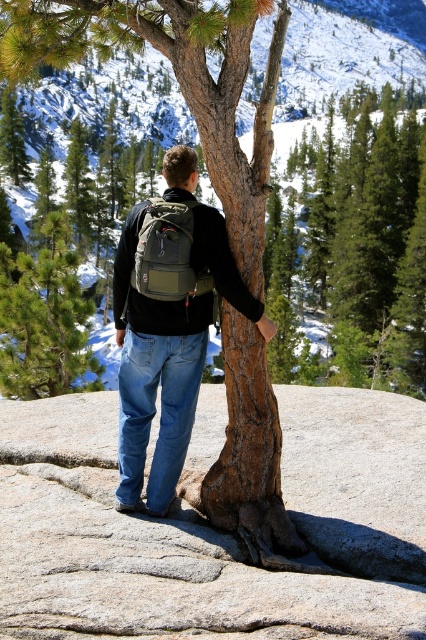
Who is lower down, rough textured rock at center or olive green fabric backpack at center?

rough textured rock at center is lower down.

I want to click on rough textured rock at center, so click(x=213, y=529).

Find the location of `rough textured rock at center`. rough textured rock at center is located at coordinates (213, 529).

This screenshot has width=426, height=640. In order to click on denim jeans at center in this screenshot , I will do `click(169, 324)`.

Does rough textured rock at center have a lesser width compared to denim jeans at center?

Correct, rough textured rock at center's width is less than denim jeans at center's.

This screenshot has width=426, height=640. I want to click on rough textured rock at center, so coord(213,529).

Does point (11, 493) come farther from viewer compared to point (131, 276)?

Yes, point (11, 493) is behind point (131, 276).

The height and width of the screenshot is (640, 426). I want to click on rough textured rock at center, so click(x=213, y=529).